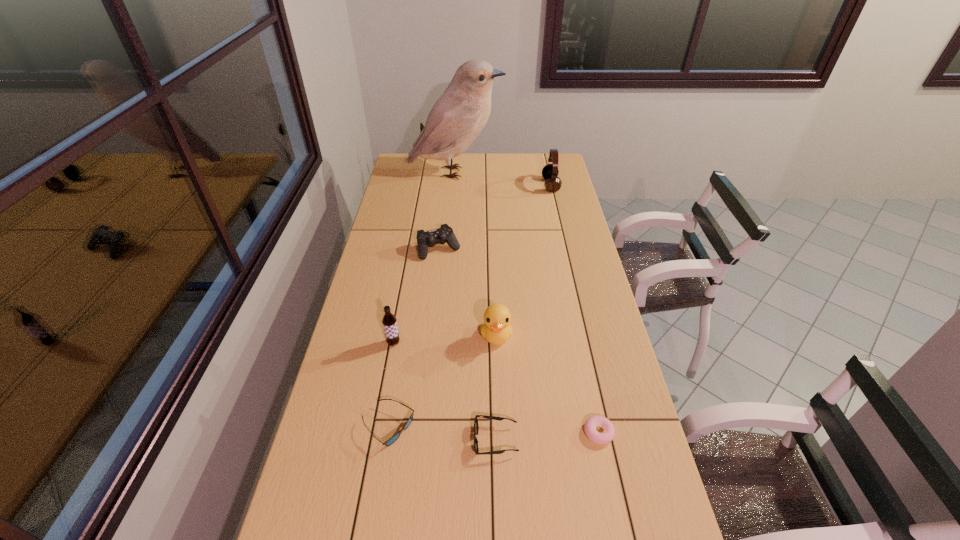
The height and width of the screenshot is (540, 960). In the image, there is a desktop. In order to click on vacant space at the right edge in this screenshot , I will do `click(591, 442)`.

This screenshot has width=960, height=540. In order to click on vacant area that lies between the fifth shortest object and the right sunglasses in this screenshot , I will do `click(496, 388)`.

Where is `vacant area between the right sunglasses and the shortest object`? This screenshot has width=960, height=540. vacant area between the right sunglasses and the shortest object is located at coordinates (547, 436).

I want to click on empty location between the tallest object and the headset, so click(x=503, y=179).

Find the location of `empty space between the fifth shortest object and the left sunglasses`. empty space between the fifth shortest object and the left sunglasses is located at coordinates coord(443,381).

Identify the location of vacant space that is in between the right sunglasses and the fourth tallest object. The height and width of the screenshot is (540, 960). (496, 388).

Where is `empty location between the shortest object and the tallest object`? The height and width of the screenshot is (540, 960). empty location between the shortest object and the tallest object is located at coordinates (527, 302).

The height and width of the screenshot is (540, 960). Find the location of `free spot between the shortest object and the right sunglasses`. free spot between the shortest object and the right sunglasses is located at coordinates (547, 436).

Locate an element on the screen. This screenshot has width=960, height=540. unoccupied area between the fourth tallest object and the control is located at coordinates (468, 292).

Locate an element on the screen. free space that is in between the doughnut and the right sunglasses is located at coordinates (547, 436).